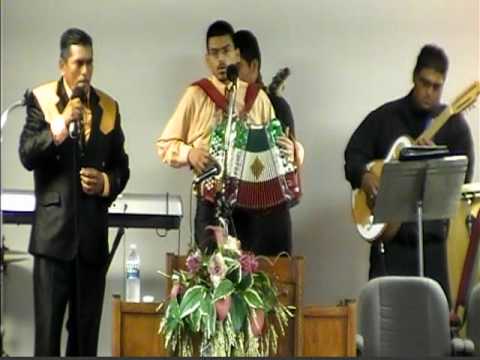
Where is `mic`? mic is located at coordinates (82, 97).